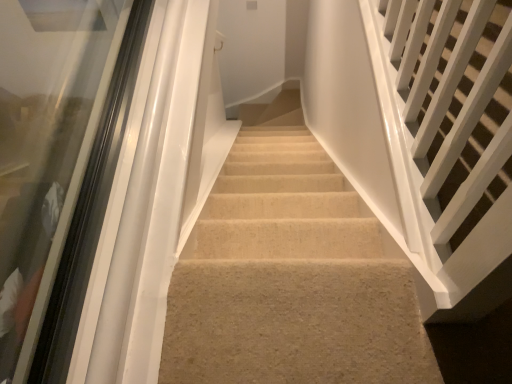
Question: From the image's perspective, is white glossy rail at right, which is the 1th stairs from right to left, located above or below transparent glass door at left?

Choices:
 (A) above
 (B) below

Answer: (A)

Question: In terms of size, does white glossy rail at right, the second stairs in the left-to-right sequence, appear bigger or smaller than transparent glass door at left?

Choices:
 (A) small
 (B) big

Answer: (B)

Question: Which object is positioned farthest from the beige carpet at center, which is counted as the first stairs, starting from the left?

Choices:
 (A) white glossy rail at right, the second stairs in the left-to-right sequence
 (B) transparent glass door at left

Answer: (B)

Question: Which of these objects is positioned farthest from the transparent glass door at left?

Choices:
 (A) beige carpet at center, the second stairs from the right
 (B) white glossy rail at right, which is the 1th stairs from right to left

Answer: (B)